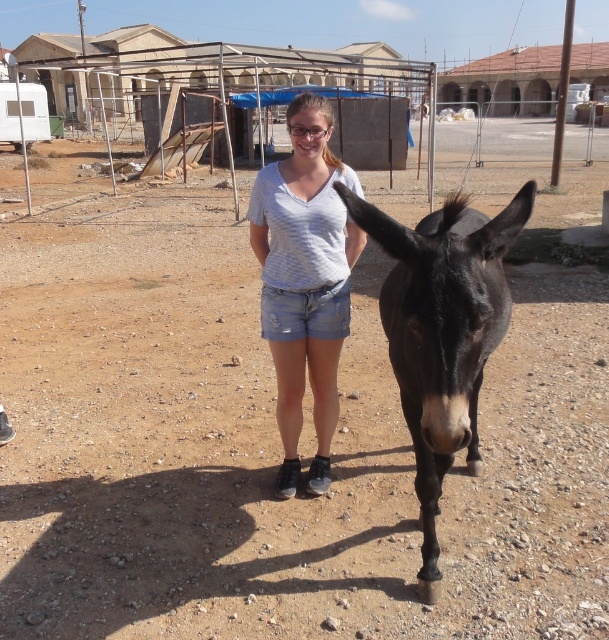
Is white striped shirt at center below denim shorts at center?

No, white striped shirt at center is not below denim shorts at center.

You are a GUI agent. You are given a task and a screenshot of the screen. Output one action in this format:
    pyautogui.click(x=<x>, y=<y>)
    Task: Click on the white striped shirt at center
    The width and height of the screenshot is (609, 640).
    Given the screenshot: What is the action you would take?
    pyautogui.click(x=304, y=292)

Between point (304, 353) and point (317, 336), which one is positioned behind?

Positioned behind is point (304, 353).

Where is `white striped shirt at center`? Image resolution: width=609 pixels, height=640 pixels. white striped shirt at center is located at coordinates (304, 292).

Which is behind, point (451, 317) or point (283, 205)?

The point (283, 205) is more distant.

Identify the location of black glossy mule at center. The height and width of the screenshot is (640, 609). (442, 332).

Who is more forward, (460, 220) or (333, 218)?

Point (460, 220) is in front.

Identify the location of black glossy mule at center. (442, 332).

Which of these two, denim shorts at center or clear plastic goggles at center, stands shorter?

Standing shorter between the two is clear plastic goggles at center.

Does denim shorts at center appear under clear plastic goggles at center?

Yes, denim shorts at center is below clear plastic goggles at center.

Between point (319, 324) and point (328, 129), which one is positioned in front?

Point (328, 129) is more forward.

This screenshot has width=609, height=640. What are the coordinates of `denim shorts at center` in the screenshot? It's located at (304, 312).